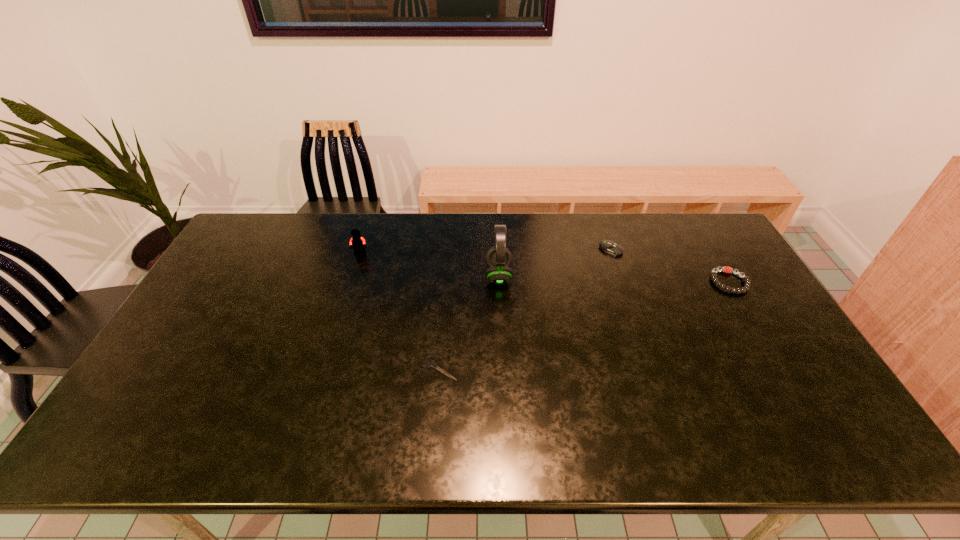
Find the location of a particular element. This screenshot has width=960, height=540. headset is located at coordinates (498, 258).

Where is `the tallest object`? the tallest object is located at coordinates [498, 258].

Where is `the fourth shortest object`? the fourth shortest object is located at coordinates (357, 241).

I want to click on the leftmost object, so click(x=357, y=241).

Locate an element on the screen. This screenshot has height=540, width=960. computer mouse is located at coordinates (608, 246).

Where is `the rightmost object`? The width and height of the screenshot is (960, 540). the rightmost object is located at coordinates (747, 283).

At what (x,y) coordinates should I click in order to perform the action: click on the second object from left to right. Please return your answer as a coordinate pair (x, y). The image size is (960, 540). Looking at the image, I should click on (431, 364).

Locate an element on the screen. The image size is (960, 540). shears is located at coordinates pos(431,364).

The height and width of the screenshot is (540, 960). I want to click on vacant position located 0.260m on the ear cups of the tallest object, so [x=406, y=275].

You are a GUI agent. You are given a task and a screenshot of the screen. Output one action in this format:
    pyautogui.click(x=<x>, y=<y>)
    Task: Click on the vacant space situated on the ear cups of the tallest object
    
    Given the screenshot: What is the action you would take?
    pyautogui.click(x=396, y=275)